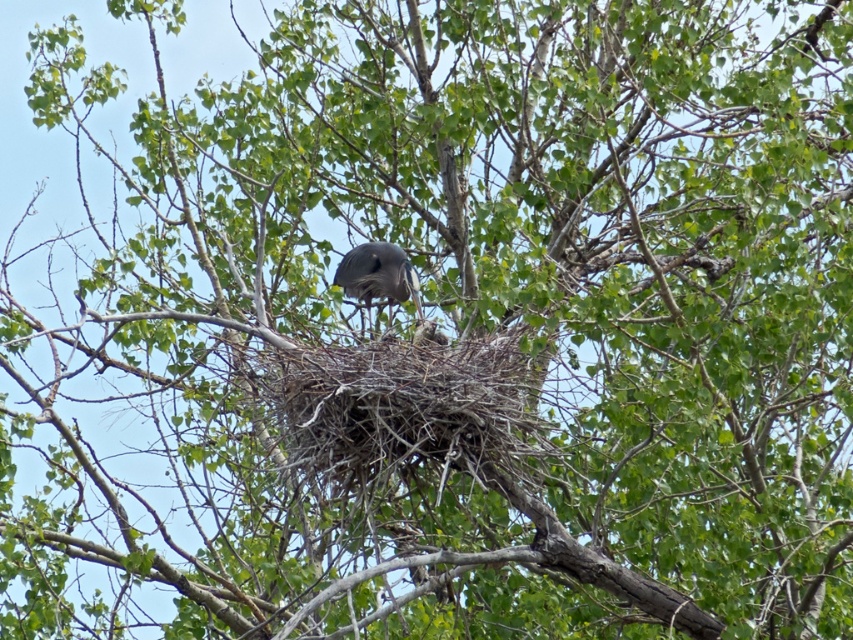
Is dark gray nest at center above gray matte bird at center?

Actually, dark gray nest at center is below gray matte bird at center.

Locate an element on the screen. dark gray nest at center is located at coordinates (408, 406).